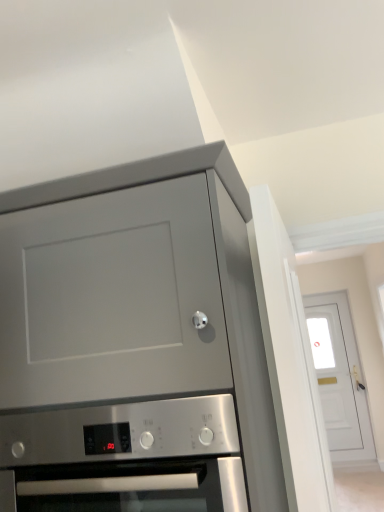
Question: Is there a large distance between white glossy door at upper right and stainless steel oven at lower center?

Choices:
 (A) no
 (B) yes

Answer: (B)

Question: Is the surface of white glossy door at upper right in direct contact with stainless steel oven at lower center?

Choices:
 (A) no
 (B) yes

Answer: (A)

Question: Is white glossy door at upper right outside stainless steel oven at lower center?

Choices:
 (A) no
 (B) yes

Answer: (B)

Question: Is white glossy door at upper right behind stainless steel oven at lower center?

Choices:
 (A) no
 (B) yes

Answer: (B)

Question: Can you confirm if white glossy door at upper right is shorter than stainless steel oven at lower center?

Choices:
 (A) no
 (B) yes

Answer: (A)

Question: Considering the positions of stainless steel oven at lower center and white glossy door at upper right in the image, is stainless steel oven at lower center taller or shorter than white glossy door at upper right?

Choices:
 (A) tall
 (B) short

Answer: (B)

Question: Visually, is stainless steel oven at lower center positioned to the left or to the right of white glossy door at upper right?

Choices:
 (A) right
 (B) left

Answer: (B)

Question: Looking at the image, does stainless steel oven at lower center seem bigger or smaller compared to white glossy door at upper right?

Choices:
 (A) big
 (B) small

Answer: (A)

Question: Which is correct: stainless steel oven at lower center is inside white glossy door at upper right, or outside of it?

Choices:
 (A) inside
 (B) outside

Answer: (B)

Question: Considering the positions of white glossy door at upper right and stainless steel oven at lower center in the image, is white glossy door at upper right taller or shorter than stainless steel oven at lower center?

Choices:
 (A) tall
 (B) short

Answer: (A)

Question: Choose the correct answer: Is white glossy door at upper right inside stainless steel oven at lower center or outside it?

Choices:
 (A) inside
 (B) outside

Answer: (B)

Question: Considering their positions, is white glossy door at upper right located in front of or behind stainless steel oven at lower center?

Choices:
 (A) front
 (B) behind

Answer: (B)

Question: Is point (345, 358) positioned closer to the camera than point (127, 505)?

Choices:
 (A) farther
 (B) closer

Answer: (A)

Question: Considering their positions, is matte gray cabinet at upper left located in front of or behind stainless steel oven at lower center?

Choices:
 (A) behind
 (B) front

Answer: (B)

Question: Based on their positions, is matte gray cabinet at upper left located to the left or right of stainless steel oven at lower center?

Choices:
 (A) left
 (B) right

Answer: (A)